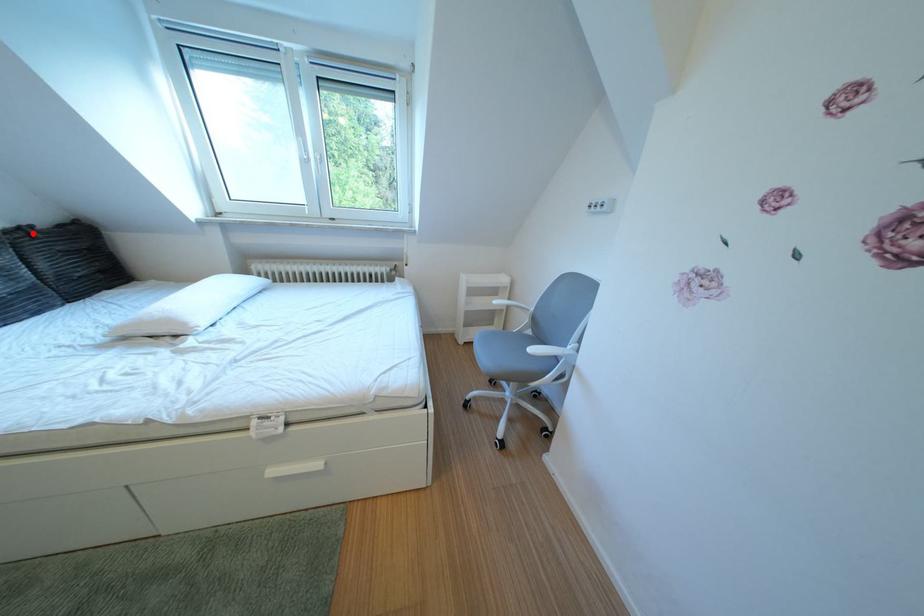
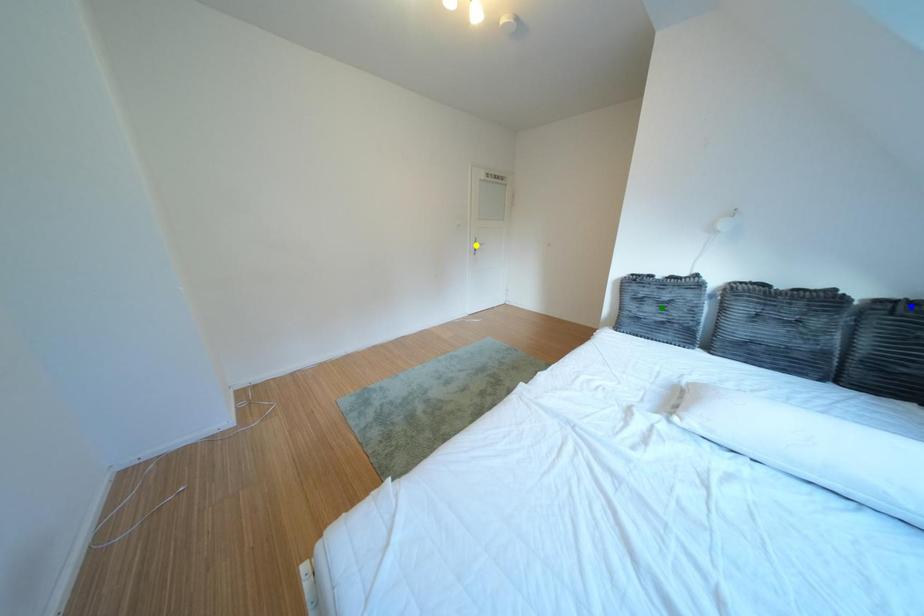
Question: I am providing you with two images of the same scene from different viewpoints. A red point is marked on the first image. You are given multiple points on the second image. Which point in image 2 represents the same 3d spot as the red point in image 1?

Choices:
 (A) green point
 (B) blue point
 (C) yellow point

Answer: (B)